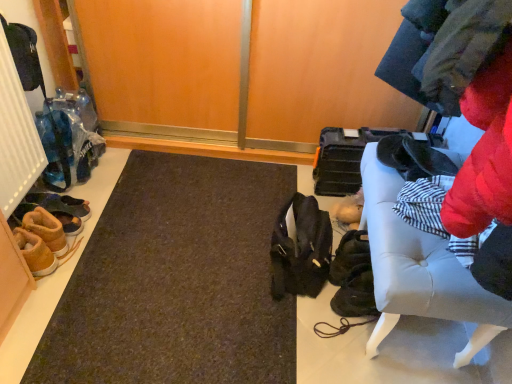
Question: Looking at their shapes, would you say brown suede shoes at lower left, which ranks as the 2th footwear in back-to-front order, is wider or thinner than tan suede boot at lower left, marked as the fourth footwear in a back-to-front arrangement?

Choices:
 (A) wide
 (B) thin

Answer: (A)

Question: From a real-world perspective, is brown suede shoes at lower left, the 3th footwear in the front-to-back sequence, above or below tan suede boot at lower left, marked as the fourth footwear in a back-to-front arrangement?

Choices:
 (A) below
 (B) above

Answer: (A)

Question: Which of these objects is positioned closest to the brown suede shoes at lower left, arranged as the second footwear when viewed from the front?

Choices:
 (A) white leather bench at right
 (B) tan suede boot at lower left, arranged as the first footwear when viewed from the front
 (C) matte black shoulder bag at center
 (D) leather sandal at left, which is counted as the 1th footwear, starting from the back
 (E) brown suede shoes at lower left, the 3th footwear in the front-to-back sequence

Answer: (E)

Question: Which of these objects is positioned closest to the brown suede shoes at lower left, arranged as the second footwear when viewed from the front?

Choices:
 (A) brown suede shoes at lower left, which ranks as the 2th footwear in back-to-front order
 (B) tan suede boot at lower left, marked as the fourth footwear in a back-to-front arrangement
 (C) white leather bench at right
 (D) leather sandal at left, which is counted as the 1th footwear, starting from the back
 (E) matte black shoulder bag at center

Answer: (A)